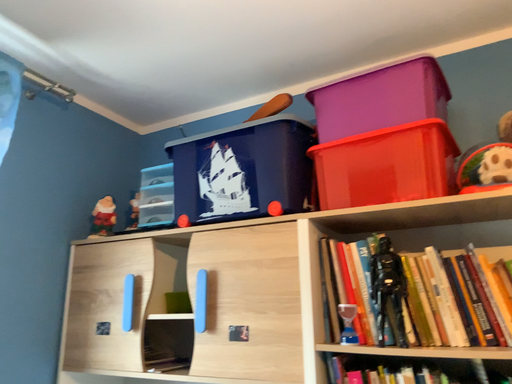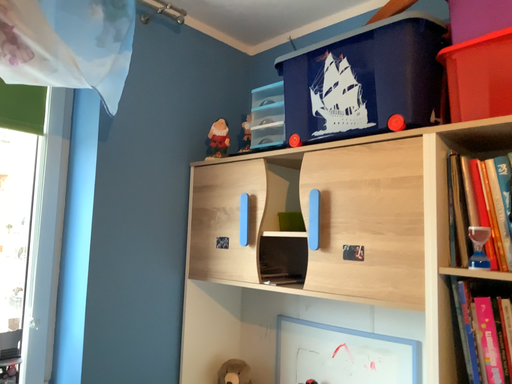
Question: Which way did the camera rotate in the video?

Choices:
 (A) rotated upward
 (B) rotated downward

Answer: (B)